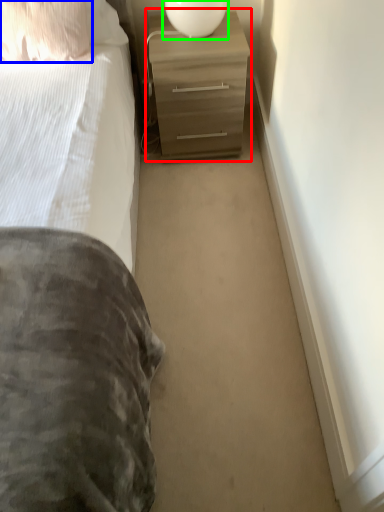
Question: Which object is the farthest from chest of drawers (highlighted by a red box)? Choose among these: pillow (highlighted by a blue box) or table lamp (highlighted by a green box).

Choices:
 (A) pillow
 (B) table lamp

Answer: (A)